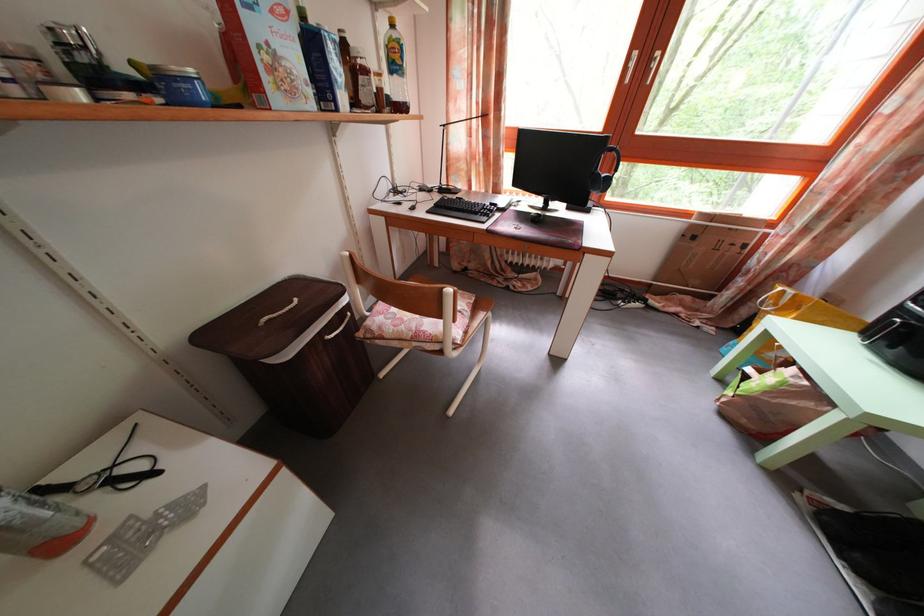
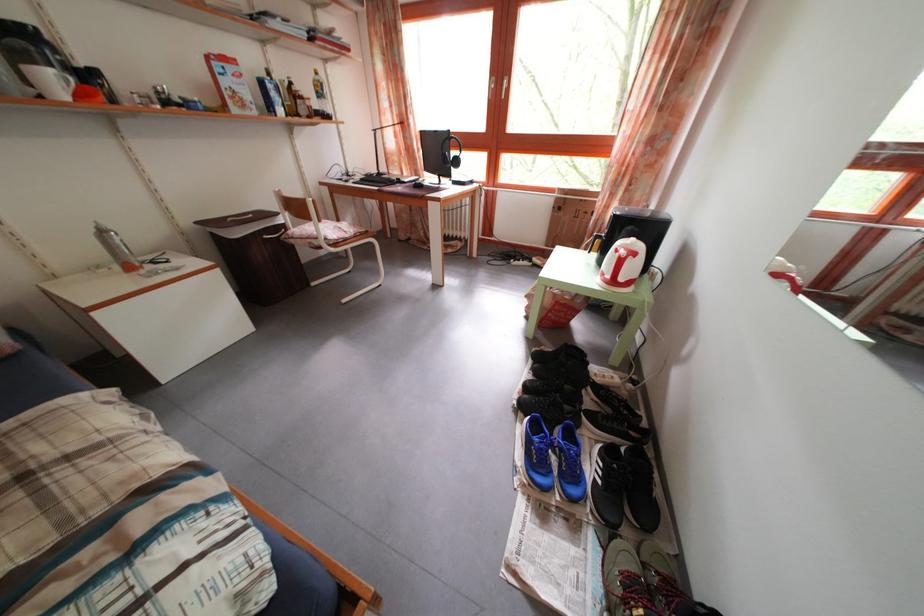
Find the pixel in the second image that matches [399,31] in the first image.

(323, 79)